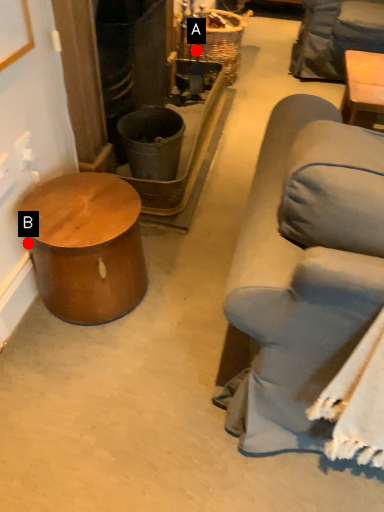
Question: Two points are circled on the image, labeled by A and B beside each circle. Which point is closer to the camera taking this photo?

Choices:
 (A) A is closer
 (B) B is closer

Answer: (B)